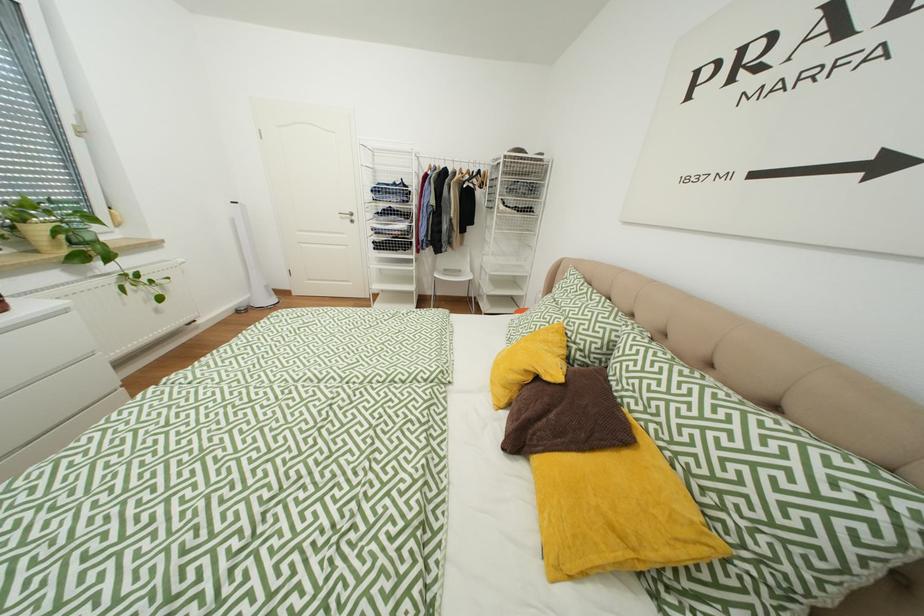
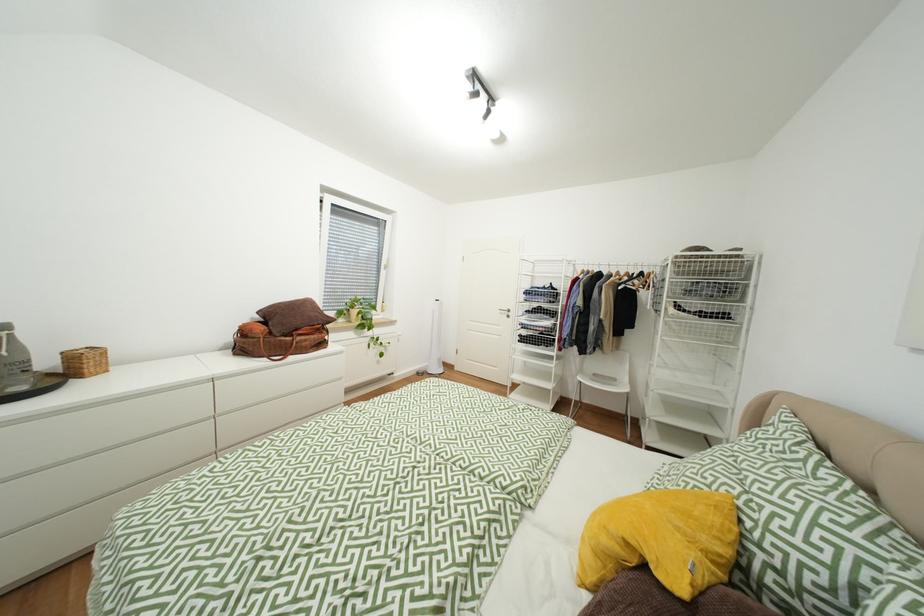
The images are taken continuously from a first-person perspective. In which direction is your viewpoint rotating?

The camera's rotation is toward left-up.